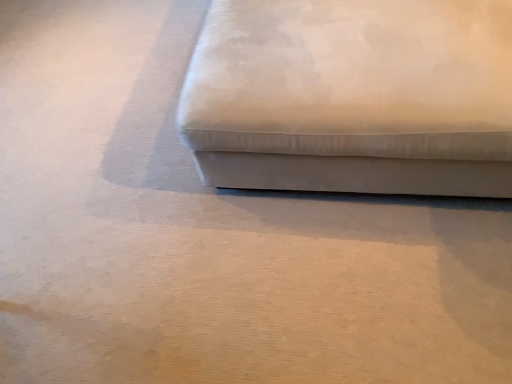
At what (x,y) coordinates should I click in order to perform the action: click on vacant region to the left of beige velvet ottoman at upper center. Please return your answer as a coordinate pair (x, y). Image resolution: width=512 pixels, height=384 pixels. Looking at the image, I should click on (104, 134).